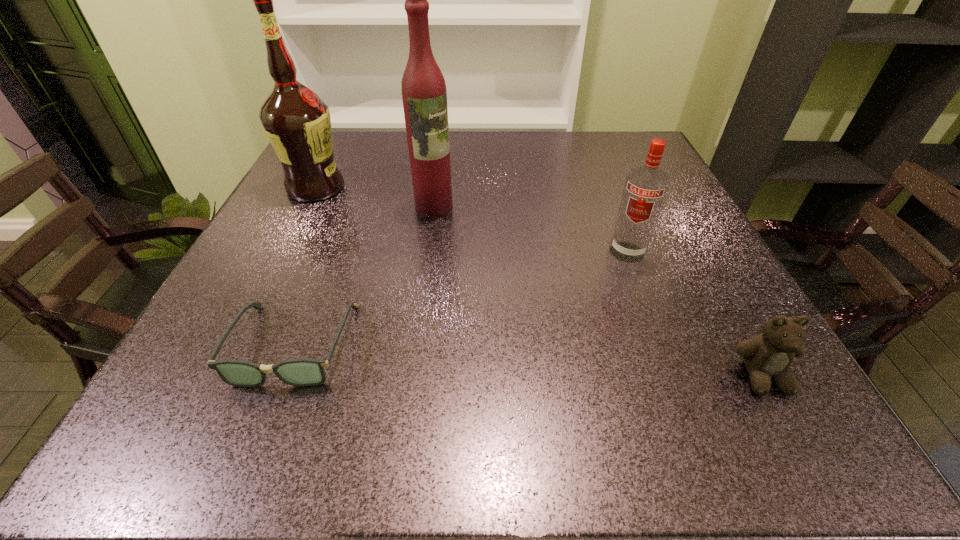
At what (x,y) coordinates should I click in order to perform the action: click on alcohol that is at the left edge. Please return your answer as a coordinate pair (x, y). The width and height of the screenshot is (960, 540). Looking at the image, I should click on (297, 122).

The width and height of the screenshot is (960, 540). Identify the location of teddy bear at the right edge. (767, 356).

I want to click on vodka located in the right edge section of the desktop, so click(x=645, y=189).

Locate an element on the screen. This screenshot has width=960, height=540. object located in the far left corner section of the desktop is located at coordinates coord(297,122).

Where is `object situated at the near left corner`? object situated at the near left corner is located at coordinates (302, 371).

This screenshot has width=960, height=540. In order to click on object that is at the near right corner in this screenshot , I will do `click(767, 356)`.

In the image, there is a desktop. Where is `vacant space at the far edge`? This screenshot has height=540, width=960. vacant space at the far edge is located at coordinates (532, 166).

At what (x,y) coordinates should I click in order to perform the action: click on vacant space at the near edge of the desktop. Please return your answer as a coordinate pair (x, y). The width and height of the screenshot is (960, 540). Looking at the image, I should click on (448, 361).

Find the location of a particular element. This screenshot has height=540, width=960. vacant space at the left edge is located at coordinates (352, 192).

The height and width of the screenshot is (540, 960). I want to click on vacant space at the right edge, so click(674, 225).